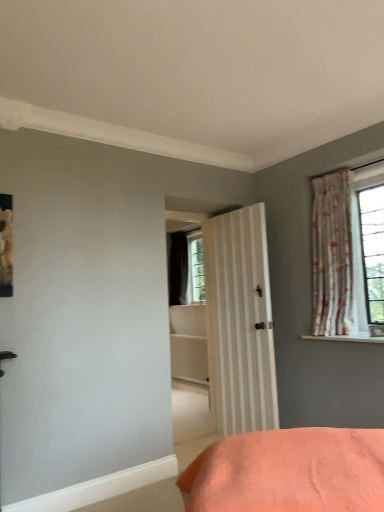
Question: Is point (319, 338) positioned closer to the camera than point (339, 252)?

Choices:
 (A) farther
 (B) closer

Answer: (B)

Question: Is white textured shelf at upper right wider or thinner than floral fabric curtain at right?

Choices:
 (A) wide
 (B) thin

Answer: (A)

Question: In terms of height, does white textured shelf at upper right look taller or shorter compared to floral fabric curtain at right?

Choices:
 (A) tall
 (B) short

Answer: (B)

Question: In terms of height, does floral fabric curtain at right look taller or shorter compared to white textured shelf at upper right?

Choices:
 (A) tall
 (B) short

Answer: (A)

Question: From a real-world perspective, is floral fabric curtain at right positioned above or below white textured shelf at upper right?

Choices:
 (A) above
 (B) below

Answer: (A)

Question: Is floral fabric curtain at right in front of or behind white textured shelf at upper right in the image?

Choices:
 (A) front
 (B) behind

Answer: (B)

Question: Is floral fabric curtain at right bigger or smaller than white textured shelf at upper right?

Choices:
 (A) big
 (B) small

Answer: (A)